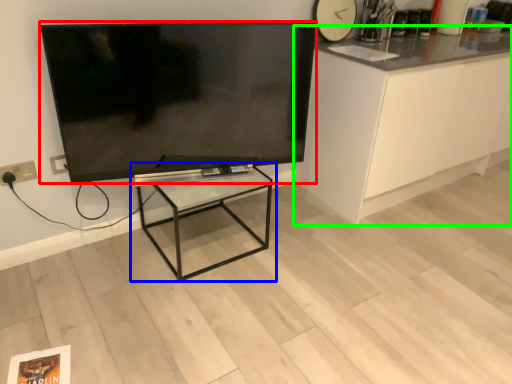
Question: Which is nearer to the television (highlighted by a red box)? table (highlighted by a blue box) or cabinetry (highlighted by a green box).

Choices:
 (A) table
 (B) cabinetry

Answer: (A)